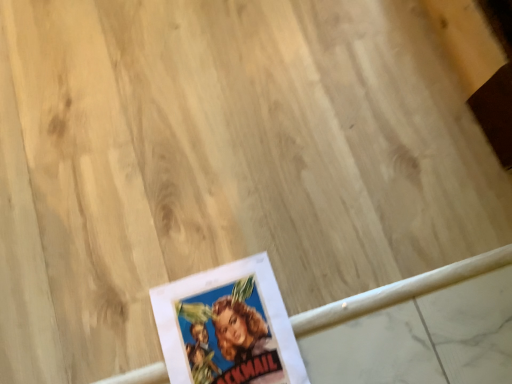
The height and width of the screenshot is (384, 512). What are the coordinates of `free region under matte paper picture frame at lower center (from a real-world perspective)` in the screenshot? It's located at (232, 334).